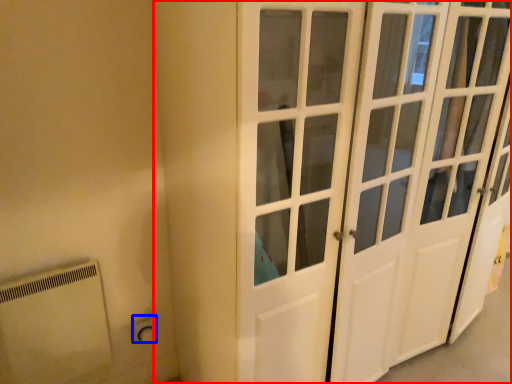
Question: Which object is further to the camera taking this photo, door (highlighted by a red box) or electric outlet (highlighted by a blue box)?

Choices:
 (A) door
 (B) electric outlet

Answer: (B)